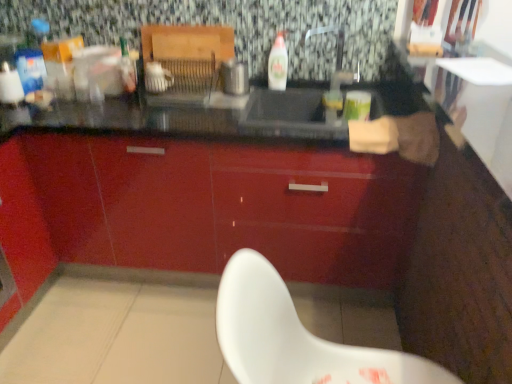
Question: Considering the relative sizes of white plastic chair at lower center and white glossy bottle at center in the image provided, is white plastic chair at lower center smaller than white glossy bottle at center?

Choices:
 (A) yes
 (B) no

Answer: (B)

Question: Is white glossy bottle at center completely or partially inside white plastic chair at lower center?

Choices:
 (A) yes
 (B) no

Answer: (B)

Question: Is white plastic chair at lower center taller than white glossy bottle at center?

Choices:
 (A) no
 (B) yes

Answer: (B)

Question: From the image's perspective, is white plastic chair at lower center under white glossy bottle at center?

Choices:
 (A) yes
 (B) no

Answer: (A)

Question: Could you tell me if white plastic chair at lower center is facing white glossy bottle at center?

Choices:
 (A) no
 (B) yes

Answer: (A)

Question: Is the depth of white plastic chair at lower center greater than that of white glossy bottle at center?

Choices:
 (A) yes
 (B) no

Answer: (B)

Question: From a real-world perspective, is white glossy bottle at center under metallic silver toaster at center?

Choices:
 (A) no
 (B) yes

Answer: (A)

Question: Can you see white glossy bottle at center touching metallic silver toaster at center?

Choices:
 (A) no
 (B) yes

Answer: (A)

Question: Are white glossy bottle at center and metallic silver toaster at center located far from each other?

Choices:
 (A) no
 (B) yes

Answer: (A)

Question: Is white glossy bottle at center at the left side of metallic silver toaster at center?

Choices:
 (A) no
 (B) yes

Answer: (A)

Question: Is white glossy bottle at center positioned beyond the bounds of metallic silver toaster at center?

Choices:
 (A) no
 (B) yes

Answer: (B)

Question: Can you confirm if white glossy bottle at center is wider than metallic silver toaster at center?

Choices:
 (A) yes
 (B) no

Answer: (B)

Question: Considering the relative sizes of white plastic chair at lower center and glossy red cabinet at center in the image provided, is white plastic chair at lower center shorter than glossy red cabinet at center?

Choices:
 (A) no
 (B) yes

Answer: (B)